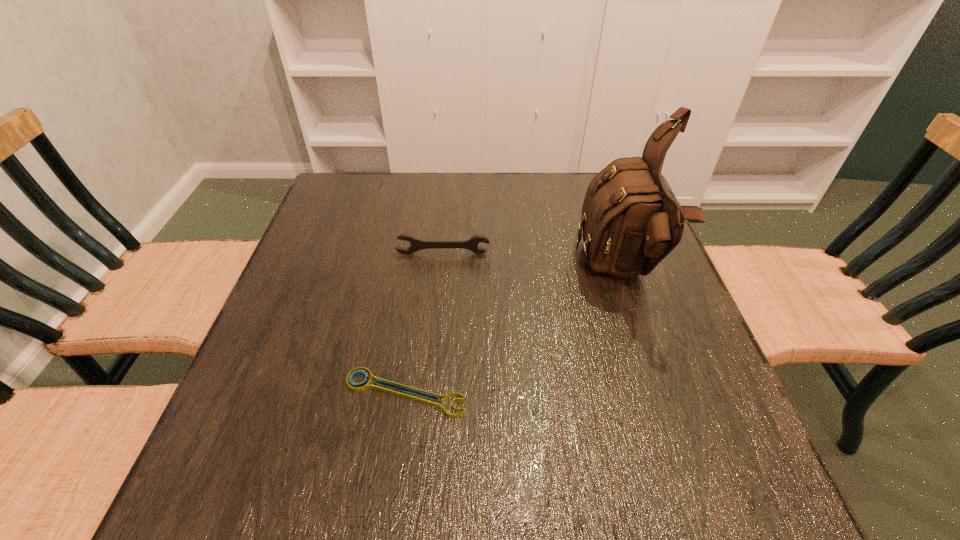
At what (x,y) coordinates should I click in order to perform the action: click on the rightmost object. Please return your answer as a coordinate pair (x, y). Looking at the image, I should click on (630, 223).

This screenshot has width=960, height=540. In order to click on shoulder bag in this screenshot , I will do `click(630, 223)`.

Locate an element on the screen. The height and width of the screenshot is (540, 960). the second tallest object is located at coordinates (416, 244).

The image size is (960, 540). In order to click on the taller wrench in this screenshot , I will do `click(416, 244)`.

The height and width of the screenshot is (540, 960). I want to click on the shortest object, so click(361, 386).

Identify the location of the nearest object. Image resolution: width=960 pixels, height=540 pixels. (361, 386).

Find the location of a particular element. The image size is (960, 540). blank space located 0.160m on the front-facing side of the tallest object is located at coordinates (512, 273).

The width and height of the screenshot is (960, 540). I want to click on vacant position located 0.210m on the front-facing side of the tallest object, so pos(490,273).

The image size is (960, 540). In order to click on free space located 0.130m on the front-facing side of the tallest object in this screenshot , I will do `click(524, 273)`.

In order to click on free space located on the open ends of the second tallest object in this screenshot , I will do `click(431, 382)`.